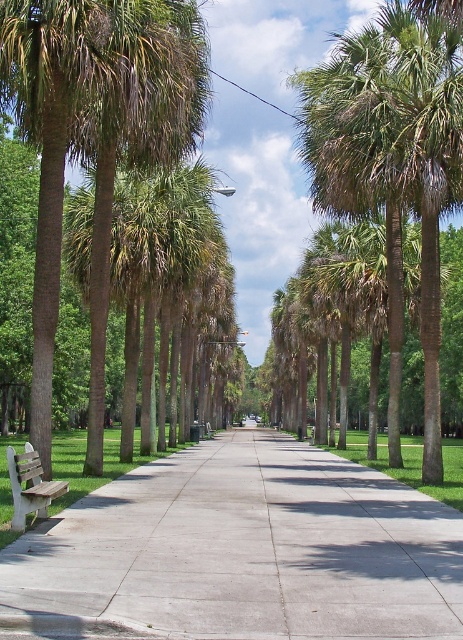
Does white concrete pavement at lower left appear over wooden bench at lower left?

No.

Who is more distant from viewer, [123,529] or [18,481]?

The point [123,529] is behind.

Does point (404, 604) come farther from viewer compared to point (47, 497)?

No, it is in front of (47, 497).

The width and height of the screenshot is (463, 640). Identify the location of white concrete pavement at lower left. (242, 552).

Is white concrete pavement at lower left smaller than green leafy palm tree at center?

Indeed, white concrete pavement at lower left has a smaller size compared to green leafy palm tree at center.

Looking at this image, is white concrete pavement at lower left wider than green leafy palm tree at center?

No, white concrete pavement at lower left is not wider than green leafy palm tree at center.

Who is more distant from viewer, (110, 486) or (442, 100)?

The point (442, 100) is more distant.

At what (x,y) coordinates should I click in order to perform the action: click on white concrete pavement at lower left. Please return your answer as a coordinate pair (x, y). The image size is (463, 640). Looking at the image, I should click on (242, 552).

Does green leafy palm tree at center appear over wooden bench at lower left?

Correct, green leafy palm tree at center is located above wooden bench at lower left.

Who is taller, green leafy palm tree at center or wooden bench at lower left?

Standing taller between the two is green leafy palm tree at center.

Measure the distance between point [361,35] and camera.

They are 131.85 feet apart.

The height and width of the screenshot is (640, 463). Identify the location of green leafy palm tree at center. point(393,163).